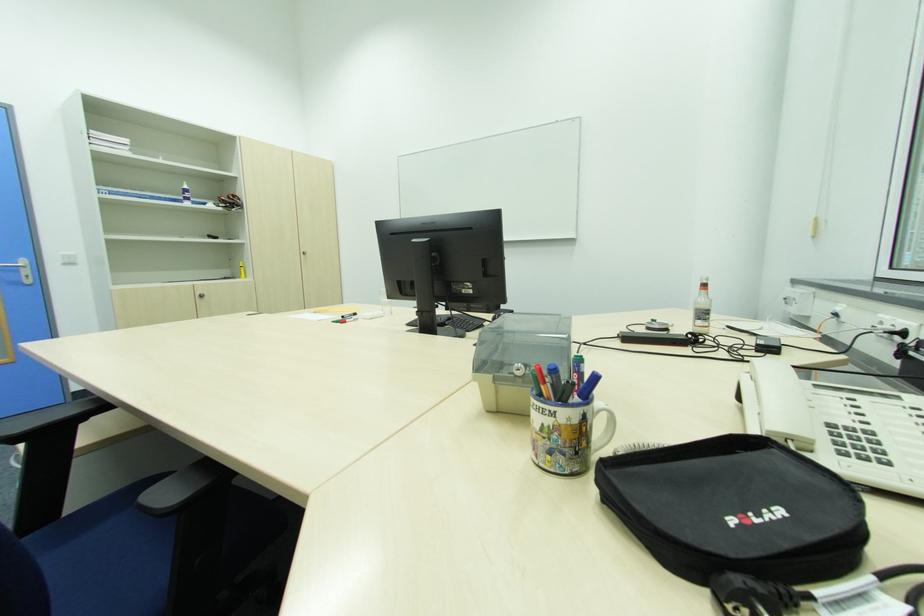
What do you see at coordinates (104, 556) in the screenshot? I see `a blue chair sitting surface` at bounding box center [104, 556].